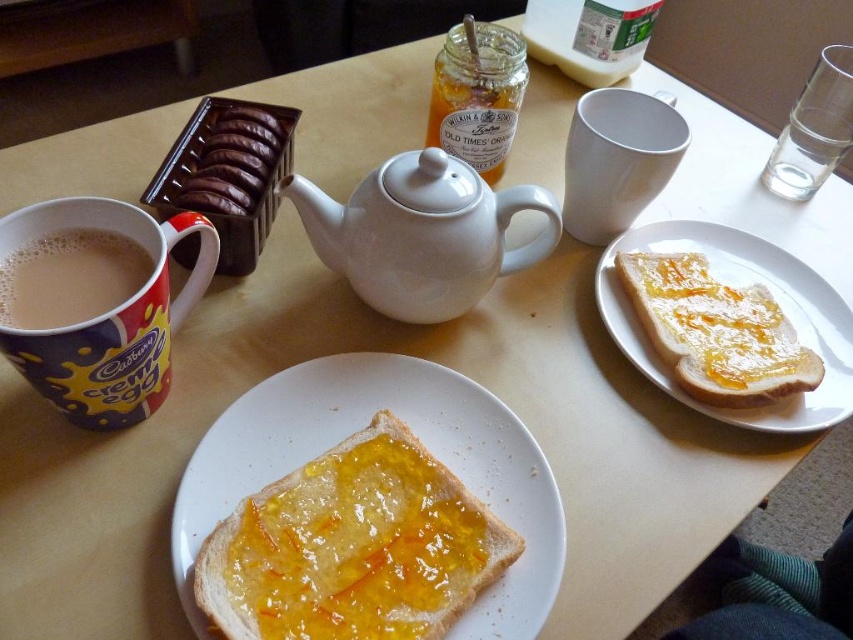
Does matte ceramic mug at left have a lesser width compared to chocolate-coated wafer at upper left?

Incorrect, matte ceramic mug at left's width is not less than chocolate-coated wafer at upper left's.

Between point (155, 387) and point (276, 168), which one is positioned behind?

The point (276, 168) is behind.

At what (x,y) coordinates should I click in order to perform the action: click on matte ceramic mug at left. Please return your answer as a coordinate pair (x, y). Looking at the image, I should click on (107, 314).

Does white glossy teapot at center have a lesser height compared to white matte mug at upper center?

Correct, white glossy teapot at center is not as tall as white matte mug at upper center.

Can you confirm if white glossy teapot at center is smaller than white matte mug at upper center?

Correct, white glossy teapot at center occupies less space than white matte mug at upper center.

Which is behind, point (466, 234) or point (622, 168)?

Positioned behind is point (622, 168).

The height and width of the screenshot is (640, 853). In order to click on white glossy teapot at center in this screenshot , I will do `click(421, 234)`.

Is yellowish matte toast at center further to the viewer compared to white glossy teapot at center?

No, yellowish matte toast at center is closer to the viewer.

Is point (440, 444) farther from viewer compared to point (381, 202)?

No, (440, 444) is closer to viewer.

The image size is (853, 640). What do you see at coordinates (360, 428) in the screenshot?
I see `yellowish matte toast at center` at bounding box center [360, 428].

In order to click on yellowish matte toast at center in this screenshot , I will do `click(360, 428)`.